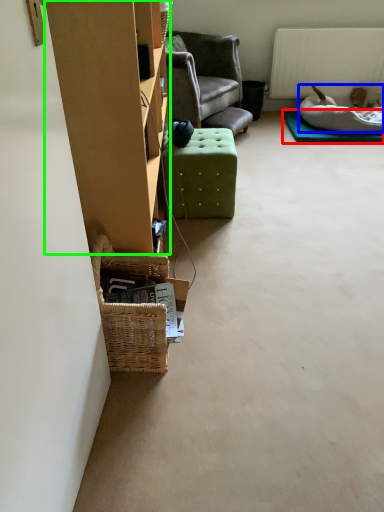
Question: Considering the real-world distances, which object is farthest from mat (highlighted by a red box)? dog bed (highlighted by a blue box) or furniture (highlighted by a green box)?

Choices:
 (A) dog bed
 (B) furniture

Answer: (B)